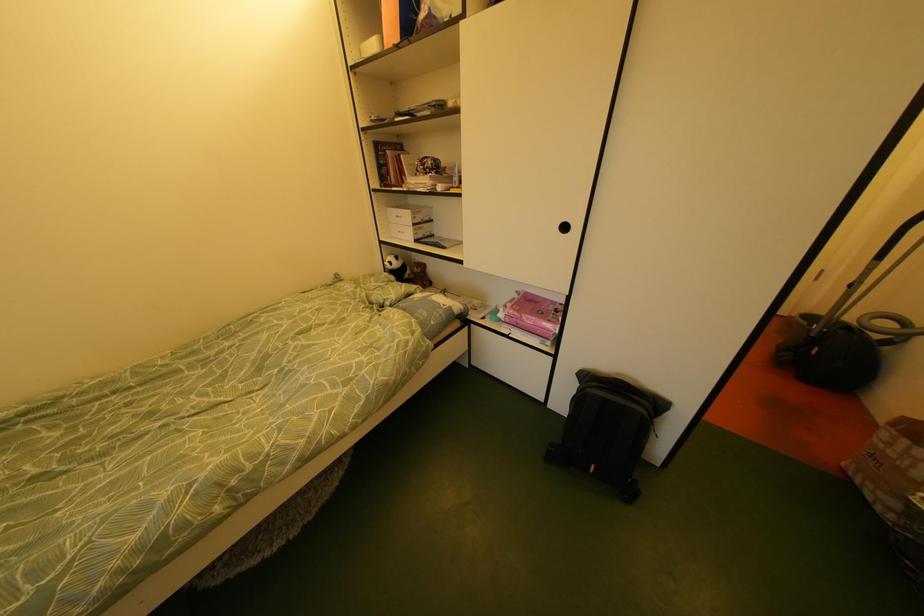
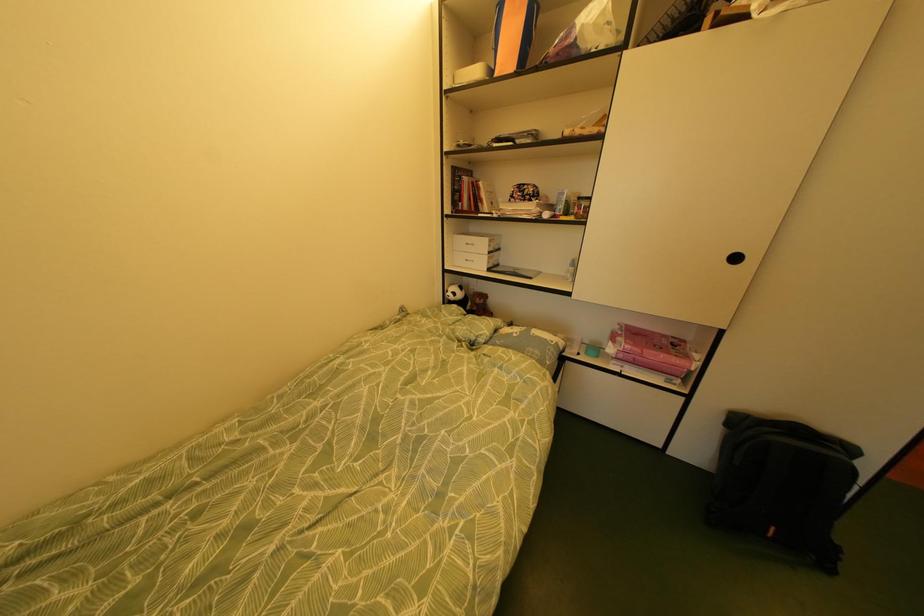
Question: Which direction would the cameraman need to move to produce the second image? Reply with the corresponding letter.

Choices:
 (A) Left
 (B) Right
 (C) Forward
 (D) Backward

Answer: (A)